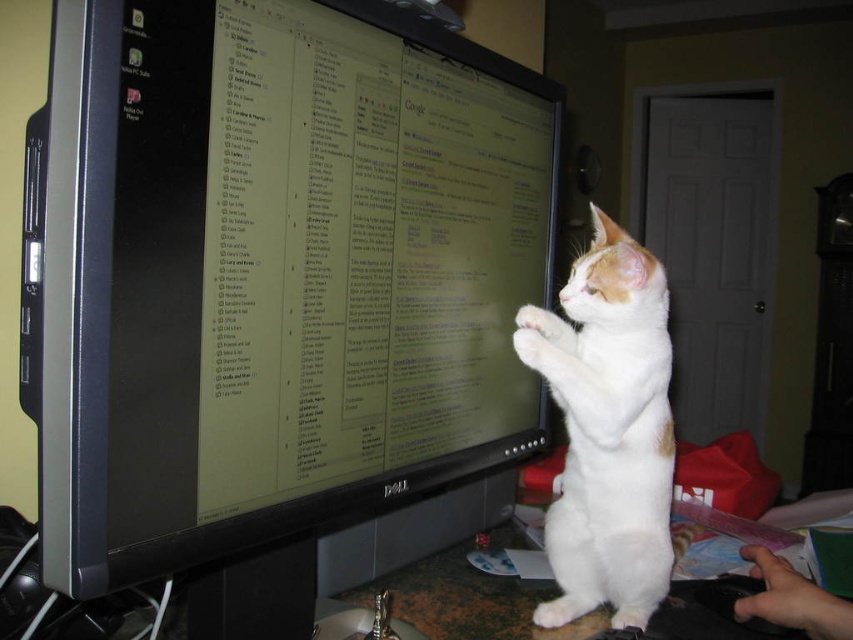
Question: Which of the following is the farthest from the observer?

Choices:
 (A) black glossy monitor at center
 (B) white fur cat at right

Answer: (B)

Question: Among these points, which one is farthest from the camera?

Choices:
 (A) (341, 65)
 (B) (631, 600)

Answer: (B)

Question: Does black glossy monitor at center come behind white fur cat at right?

Choices:
 (A) yes
 (B) no

Answer: (B)

Question: Does black glossy monitor at center have a larger size compared to white fur cat at right?

Choices:
 (A) no
 (B) yes

Answer: (B)

Question: Is black glossy monitor at center behind white fur cat at right?

Choices:
 (A) yes
 (B) no

Answer: (B)